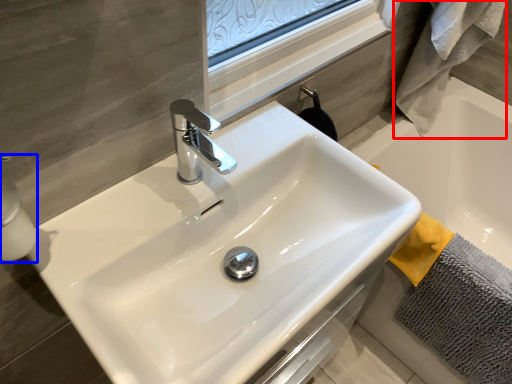
Question: Among these objects, which one is nearest to the camera, bath towel (highlighted by a red box) or soap dispenser (highlighted by a blue box)?

Choices:
 (A) bath towel
 (B) soap dispenser

Answer: (B)